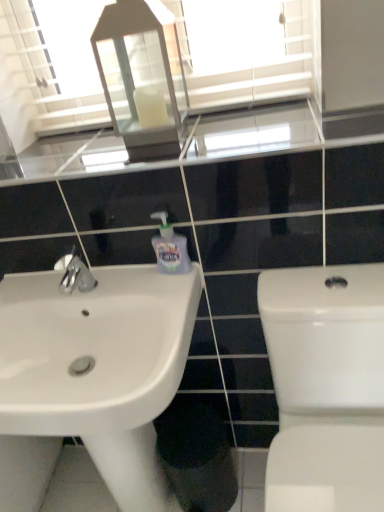
Identify the location of vacant space to the left of white glass lantern at upper center. This screenshot has height=512, width=384. coord(81,148).